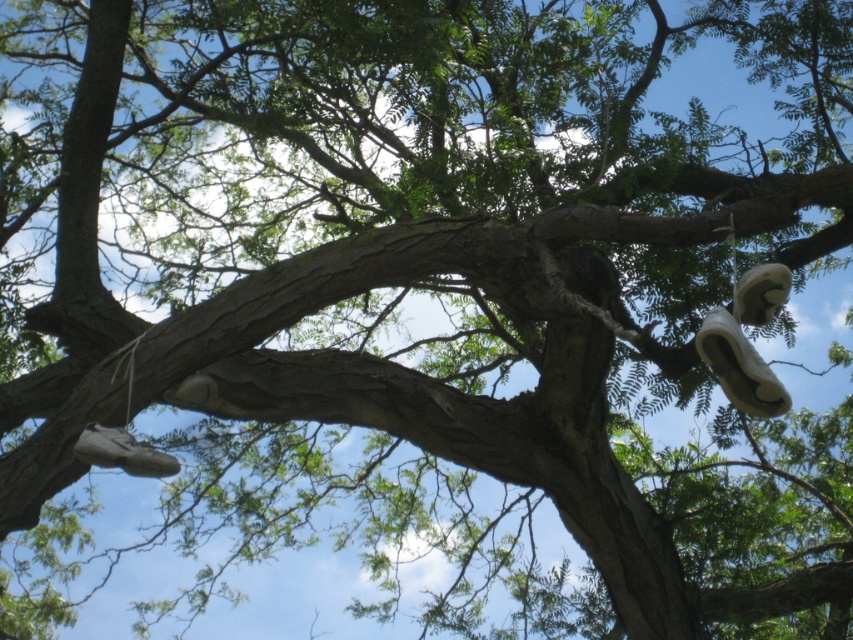
Question: Where is white matte shoe at upper right located in relation to white matte shoe at lower left in the image?

Choices:
 (A) below
 (B) above

Answer: (B)

Question: Is white matte shoe at lower left wider than white suede shoe at upper right?

Choices:
 (A) no
 (B) yes

Answer: (B)

Question: Which of the following is the closest to the observer?

Choices:
 (A) white suede shoe at upper right
 (B) white matte shoe at lower left
 (C) white matte shoe at upper right

Answer: (C)

Question: Can you confirm if white matte shoe at lower left is wider than white suede shoe at upper right?

Choices:
 (A) no
 (B) yes

Answer: (B)

Question: Based on their relative distances, which object is nearer to the white matte shoe at lower left?

Choices:
 (A) white matte shoe at upper right
 (B) white suede shoe at upper right

Answer: (A)

Question: Which object appears closest to the camera in this image?

Choices:
 (A) white matte shoe at upper right
 (B) white suede shoe at upper right

Answer: (A)